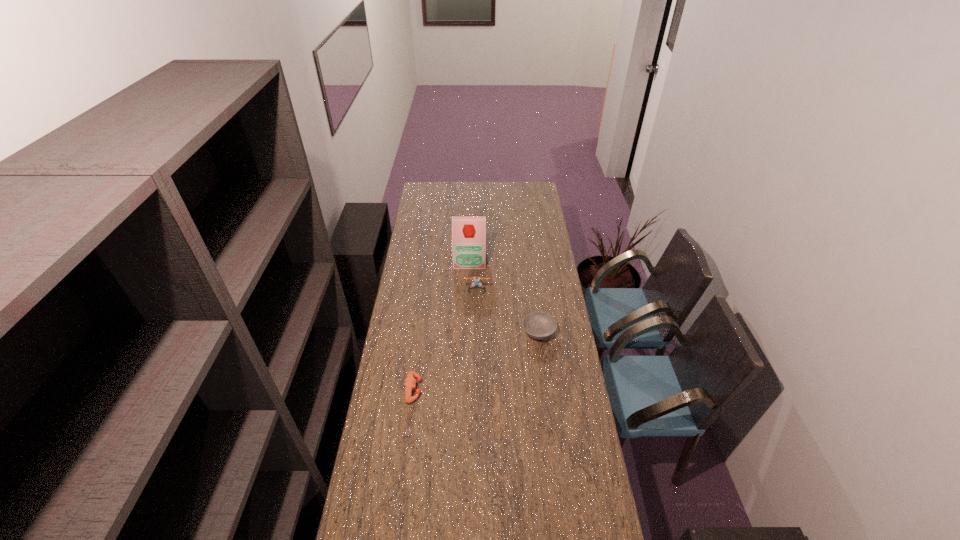
At what (x,y) coordinates should I click in order to perform the action: click on free point between the bowl and the nearest object. Please return your answer as a coordinate pair (x, y). Looking at the image, I should click on (476, 361).

Find the location of a particular element. Image resolution: width=960 pixels, height=540 pixels. free area in between the rightmost object and the leftmost object is located at coordinates (476, 361).

Where is `vacant point located between the second nearest object and the farther puncher`? vacant point located between the second nearest object and the farther puncher is located at coordinates (508, 312).

The image size is (960, 540). I want to click on free area in between the second tallest object and the rightmost object, so click(508, 312).

Locate an element on the screen. This screenshot has width=960, height=540. vacant space that is in between the soya milk and the rightmost object is located at coordinates (504, 295).

This screenshot has height=540, width=960. I want to click on free space between the tallest object and the nearer puncher, so click(x=442, y=324).

The image size is (960, 540). I want to click on empty space that is in between the right puncher and the bowl, so click(508, 312).

Find the location of a particular element. empty space that is in between the rightmost object and the leftmost object is located at coordinates (476, 361).

Where is `free spot between the leftmost object and the farthest object`? Image resolution: width=960 pixels, height=540 pixels. free spot between the leftmost object and the farthest object is located at coordinates (442, 324).

This screenshot has width=960, height=540. I want to click on object that is the nearest to the tallest object, so click(x=476, y=279).